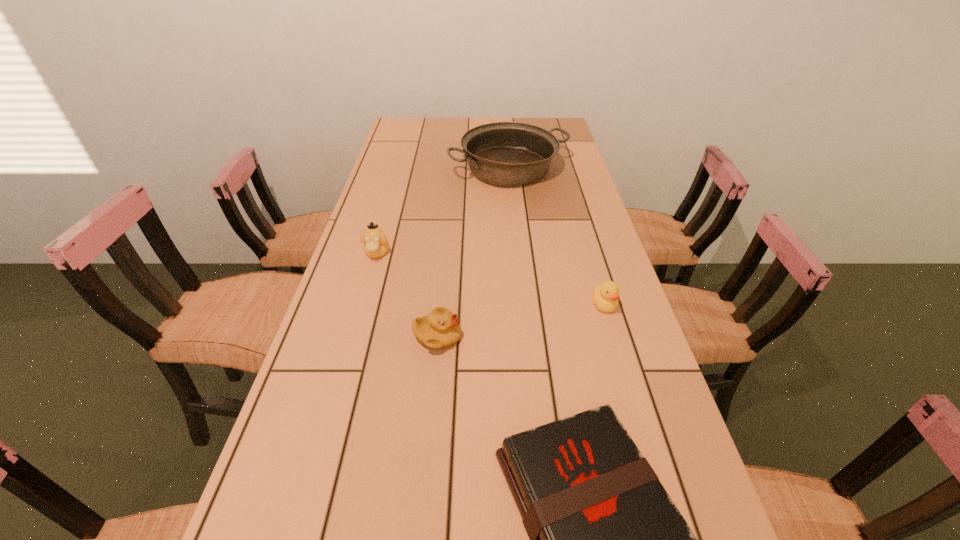
Locate an element on the screen. This screenshot has width=960, height=540. the farthest object is located at coordinates (502, 153).

This screenshot has width=960, height=540. What are the coordinates of `the fourth nearest object` in the screenshot? It's located at (x=376, y=245).

The width and height of the screenshot is (960, 540). I want to click on the leftmost object, so click(x=376, y=245).

Find the location of a particular element. the fourth farthest object is located at coordinates (440, 329).

Identify the location of the second duckling from right to left. (440, 329).

Image resolution: width=960 pixels, height=540 pixels. I want to click on the third farthest object, so click(605, 296).

Identify the location of the rightmost duckling. (605, 296).

Identify the location of vacant area situated 0.260m on the left of the farthest object. (377, 169).

Locate an element on the screen. This screenshot has height=540, width=960. vacant space located 0.170m on the face of the farthest duckling is located at coordinates (361, 309).

The width and height of the screenshot is (960, 540). I want to click on free space located on the front-facing side of the second duckling from right to left, so click(x=537, y=337).